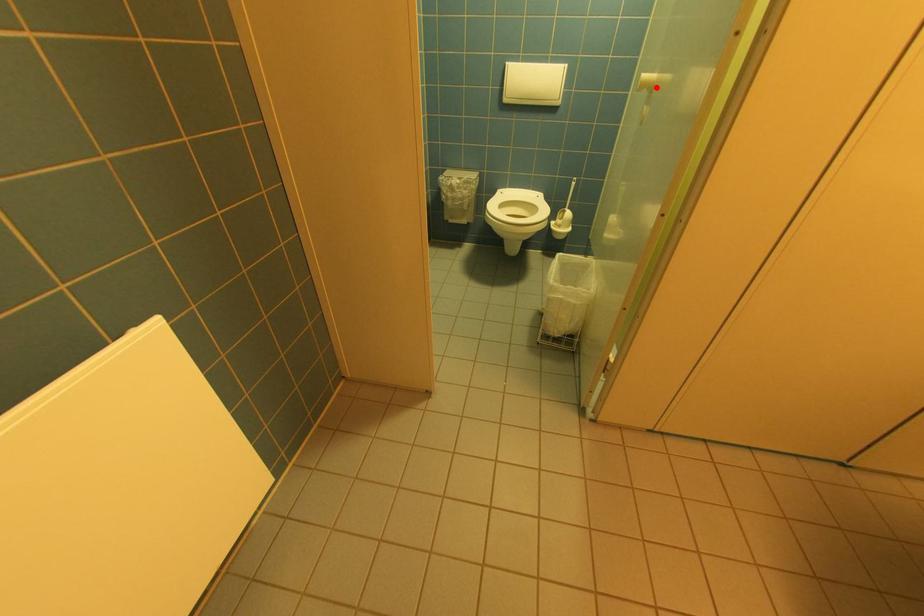
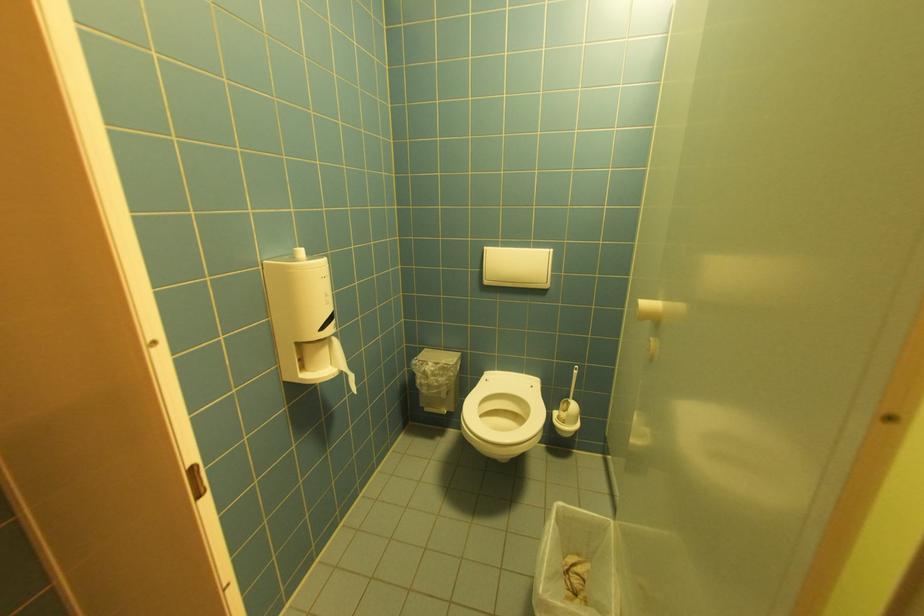
Where in the second image is the point corresponding to the highlighted location from the first image?

(663, 321)